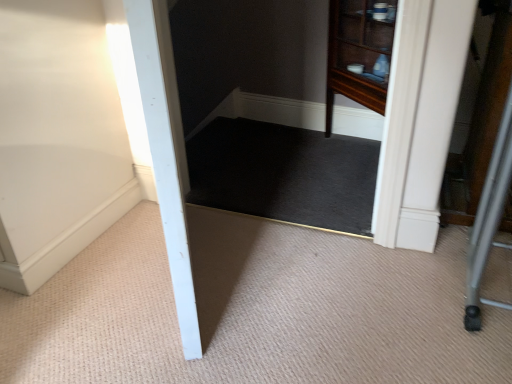
Locate an element on the screen. black carpet at center is located at coordinates (284, 174).

What do you see at coordinates (284, 174) in the screenshot?
I see `black carpet at center` at bounding box center [284, 174].

Image resolution: width=512 pixels, height=384 pixels. Describe the element at coordinates (253, 310) in the screenshot. I see `carpet at center` at that location.

I want to click on carpet at center, so click(253, 310).

You are a GUI agent. You are given a task and a screenshot of the screen. Output one action in this format:
    pyautogui.click(x=<x>, y=<y>)
    Task: Click on the black carpet at center
    This screenshot has width=512, height=384.
    Given the screenshot: What is the action you would take?
    pyautogui.click(x=284, y=174)

Between carpet at center and black carpet at center, which one appears on the right side from the viewer's perspective?

black carpet at center.

Is carpet at center further to the viewer compared to black carpet at center?

That is False.

Is point (397, 351) less distant than point (347, 217)?

Yes.

From the image's perspective, would you say carpet at center is shown under black carpet at center?

Correct, carpet at center appears lower than black carpet at center in the image.

From a real-world perspective, which is physically below, carpet at center or black carpet at center?

carpet at center.

Which of these two, carpet at center or black carpet at center, is thinner?

Thinner between the two is black carpet at center.

Considering the sizes of objects carpet at center and black carpet at center in the image provided, who is taller, carpet at center or black carpet at center?

With more height is carpet at center.

Considering the relative sizes of carpet at center and black carpet at center in the image provided, is carpet at center smaller than black carpet at center?

Actually, carpet at center might be larger than black carpet at center.

Is carpet at center inside the boundaries of black carpet at center, or outside?

carpet at center cannot be found inside black carpet at center.

Is carpet at center in contact with black carpet at center?

No, carpet at center is not beside black carpet at center.

Is carpet at center oriented towards black carpet at center?

No, carpet at center is not facing towards black carpet at center.

Where is `plain in front of the black carpet at center`? This screenshot has height=384, width=512. plain in front of the black carpet at center is located at coordinates (253, 310).

Does black carpet at center appear on the left side of carpet at center?

No, black carpet at center is not to the left of carpet at center.

Which is in front, black carpet at center or carpet at center?

carpet at center is in front.

Between point (349, 162) and point (197, 236), which one is positioned in front?

Positioned in front is point (197, 236).

From the image's perspective, is black carpet at center above or below carpet at center?

Clearly, from the image's perspective, black carpet at center is above carpet at center.

From a real-world perspective, is black carpet at center positioned above or below carpet at center?

Clearly, from a real-world perspective, black carpet at center is above carpet at center.

Which object is thinner, black carpet at center or carpet at center?

black carpet at center is thinner.

From the picture: Who is taller, black carpet at center or carpet at center?

carpet at center is taller.

Can you confirm if black carpet at center is smaller than carpet at center?

Yes, black carpet at center is smaller than carpet at center.

Would you say black carpet at center is outside carpet at center?

No, black carpet at center is not entirely external to carpet at center.

Is black carpet at center beside carpet at center?

They are not placed beside each other.

Could you tell me if black carpet at center is facing carpet at center?

Yes, black carpet at center is facing carpet at center.

Looking at this image, what's the angular difference between black carpet at center and carpet at center's facing directions?

1.32 degrees.

Where is `mat that is above the carpet at center (from the image's perspective)`? The image size is (512, 384). mat that is above the carpet at center (from the image's perspective) is located at coordinates (284, 174).

This screenshot has height=384, width=512. What are the coordinates of `mat lying behind the carpet at center` in the screenshot? It's located at (284, 174).

What are the coordinates of `mat that appears on the right of carpet at center` in the screenshot? It's located at (284, 174).